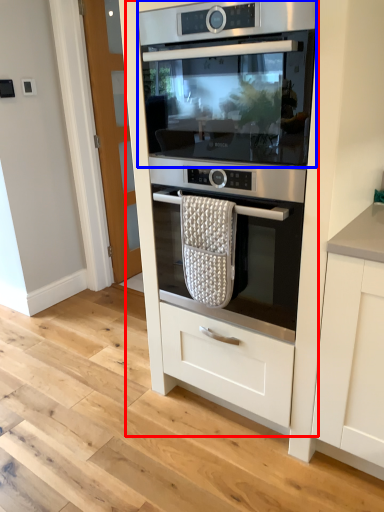
Question: Which point is further to the camera, oven (highlighted by a red box) or home appliance (highlighted by a blue box)?

Choices:
 (A) oven
 (B) home appliance

Answer: (B)